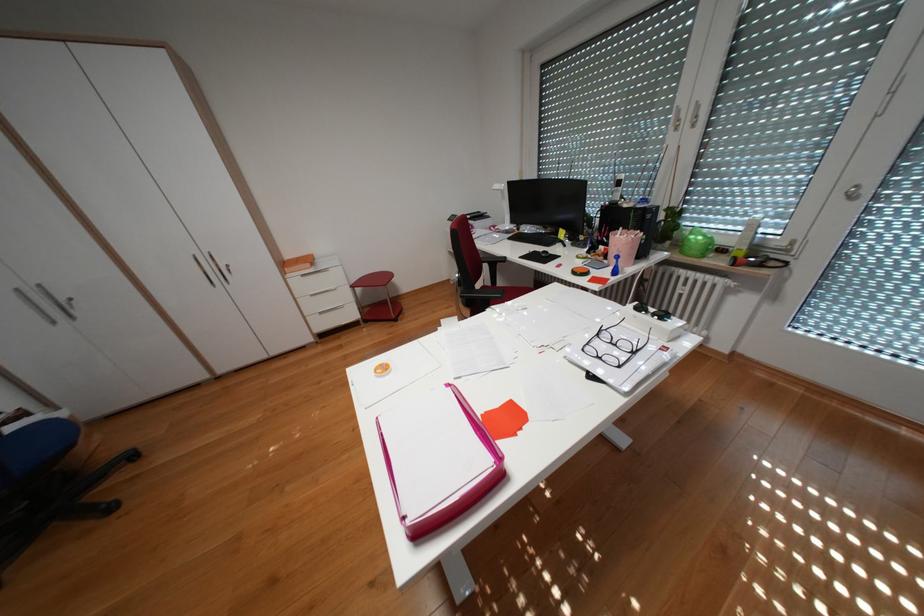
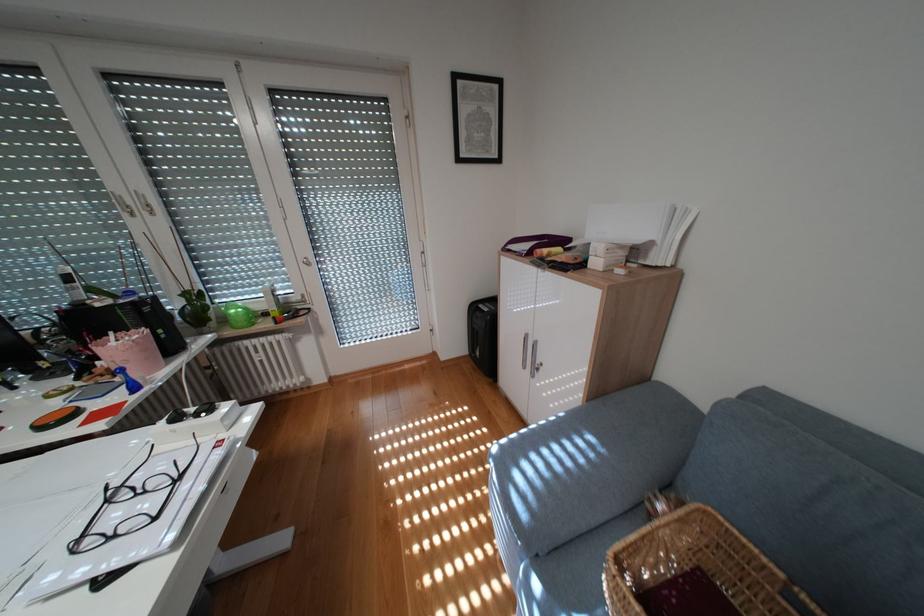
In the second image, find the point that corresponds to point (703, 233) in the first image.

(239, 308)